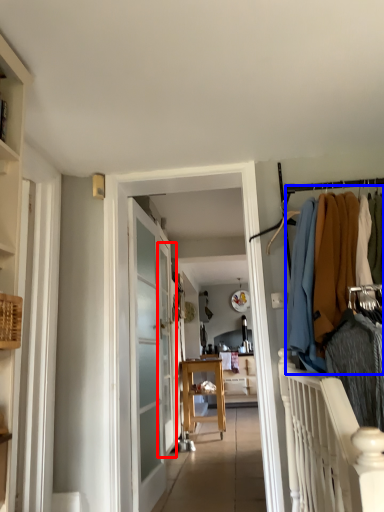
Question: Which object appears farthest to the camera in this image, screen door (highlighted by a red box) or clothing (highlighted by a blue box)?

Choices:
 (A) screen door
 (B) clothing

Answer: (A)